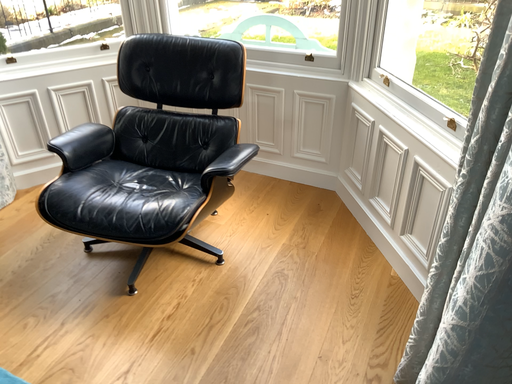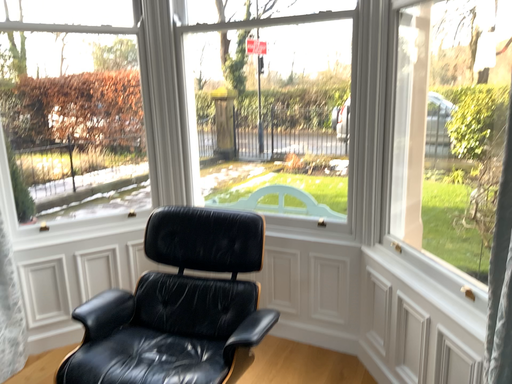
Question: How did the camera likely rotate when shooting the video?

Choices:
 (A) rotated downward
 (B) rotated upward

Answer: (B)